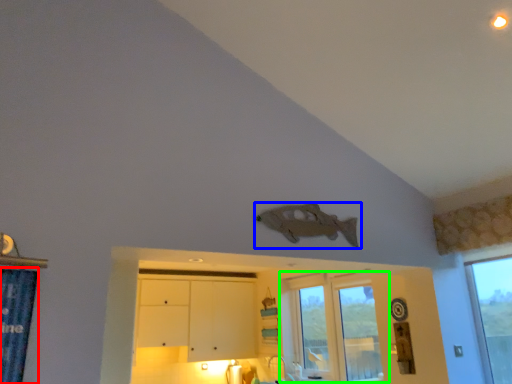
Question: Based on their relative distances, which object is farther from shower curtain (highlighted by a red box)? Choose from fish (highlighted by a blue box) and window (highlighted by a green box).

Choices:
 (A) fish
 (B) window

Answer: (B)